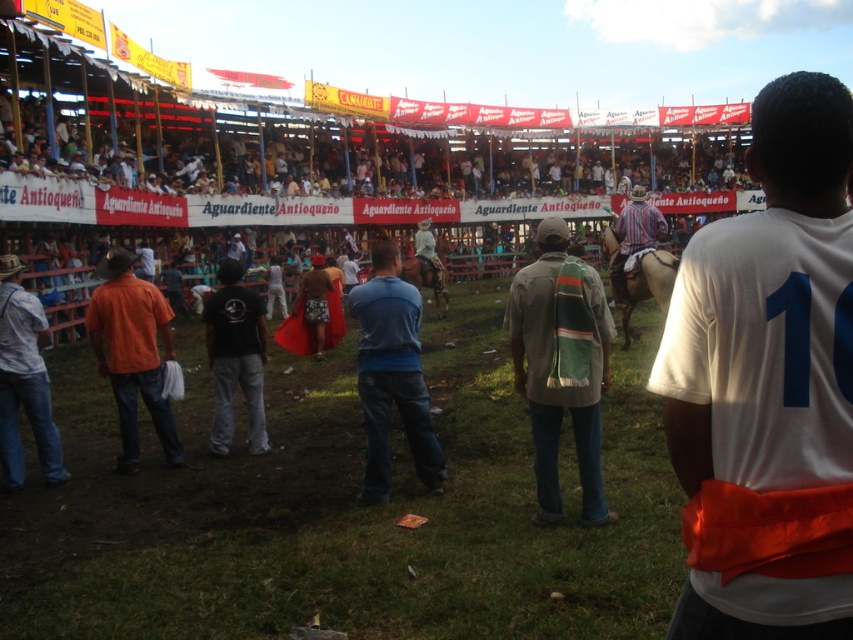
Question: Which of these objects is positioned farthest from the striped cotton shirt at center?

Choices:
 (A) black cotton t-shirt at center
 (B) white jersey at center
 (C) orange cotton shirt at left

Answer: (B)

Question: Can you confirm if orange cotton shirt at left is positioned to the left of black cotton t-shirt at center?

Choices:
 (A) no
 (B) yes

Answer: (B)

Question: Which object is the closest to the striped cotton shirt at center?

Choices:
 (A) khaki fabric shirt at center
 (B) black cotton t-shirt at center
 (C) blue jeans at center

Answer: (B)

Question: Which object is closer to the camera taking this photo?

Choices:
 (A) khaki fabric shirt at center
 (B) white jersey at center
 (C) black cotton t-shirt at center

Answer: (B)

Question: Observing the image, what is the correct spatial positioning of denim jeans at lower left in reference to black cotton t-shirt at center?

Choices:
 (A) above
 (B) below

Answer: (A)

Question: Can you confirm if black cotton t-shirt at center is thinner than striped cotton shirt at center?

Choices:
 (A) yes
 (B) no

Answer: (A)